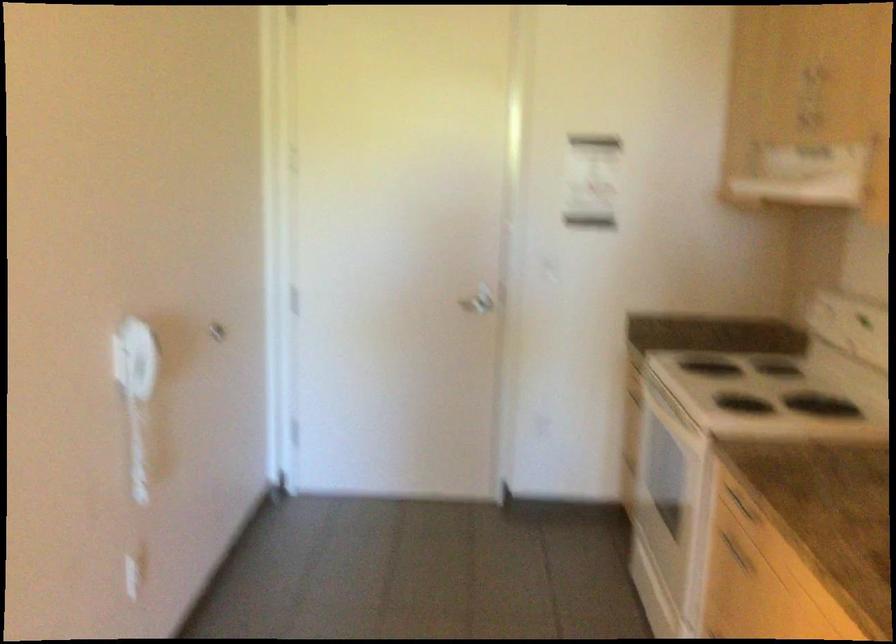
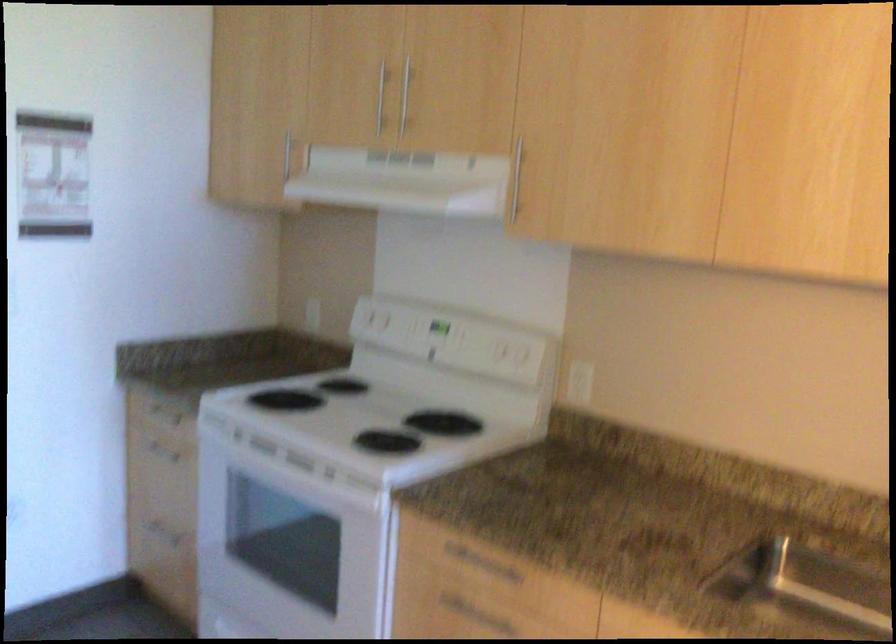
Where in the second image is the point corresponding to point 739,545 from the first image?

(466, 609)